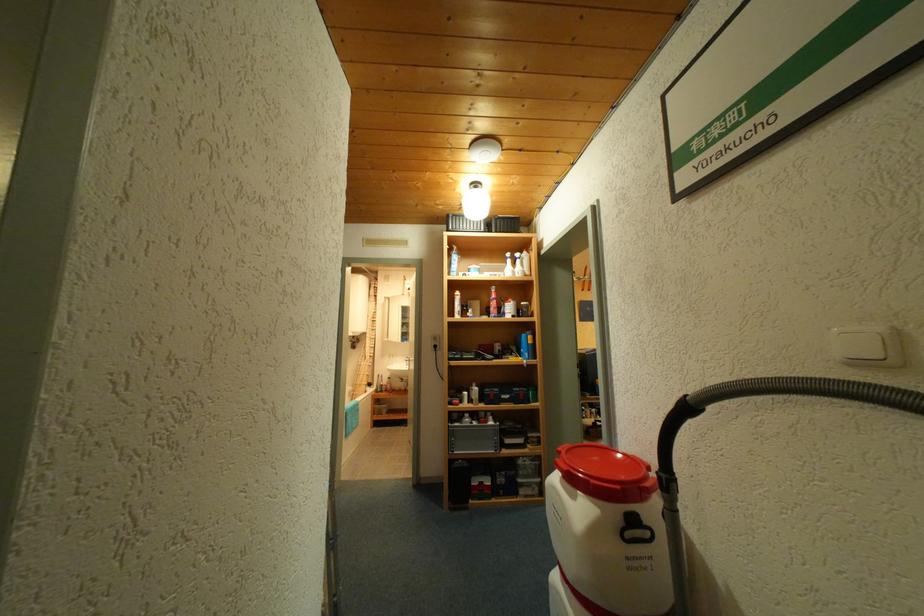
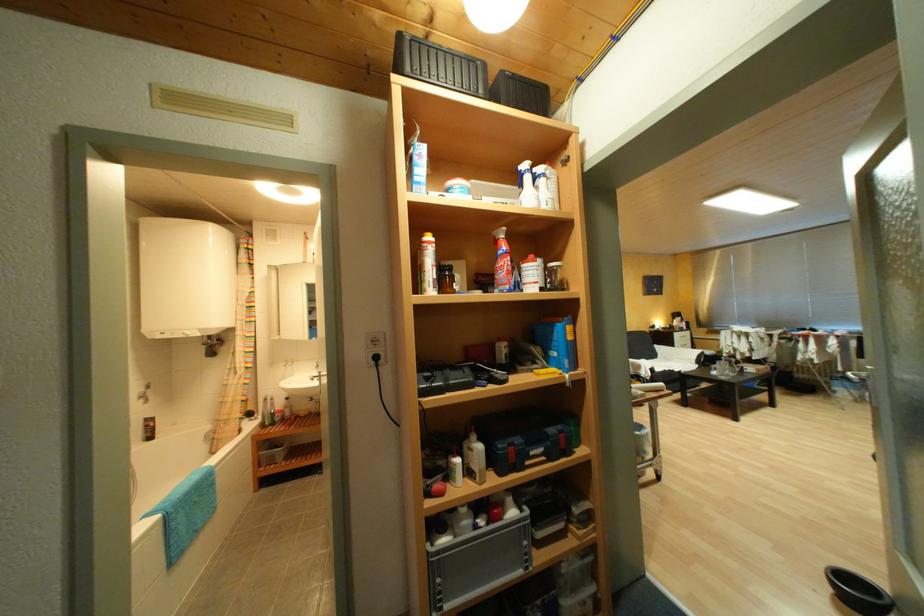
In the second image, find the point that corresponds to [408,363] in the first image.

(312, 378)